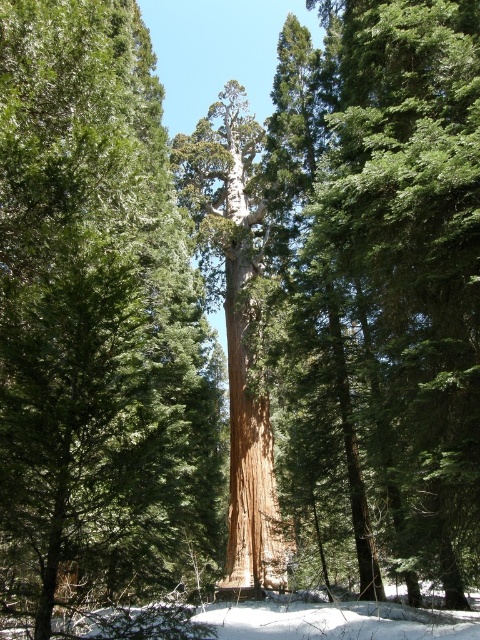
You are standing in the forest looking at the image. If you were to walk directly towards the smooth brown trunk at center, which direction should you face?

Since the smooth brown trunk at center is located at point (97,326) in the image, you should face towards the lower portion of the image to walk directly towards it.

You are an environmental scientist examining the forest. You notice the smooth brown tree trunk at center and the rough bark tree at center. Which of these two trees takes up more space in the forest area?

The rough bark tree at center occupies more space than the smooth brown tree at center, as per the description provided.

You are a hiker standing in front of the giant sequoia tree. You notice two trees at the center of your view, the smooth brown trunk at center and the rough bark tree at center. Which one do you see first as you look towards the center?

The smooth brown trunk at center is closer to the viewer than the rough bark tree at center, so you see the smooth brown trunk at center first when looking towards the center.